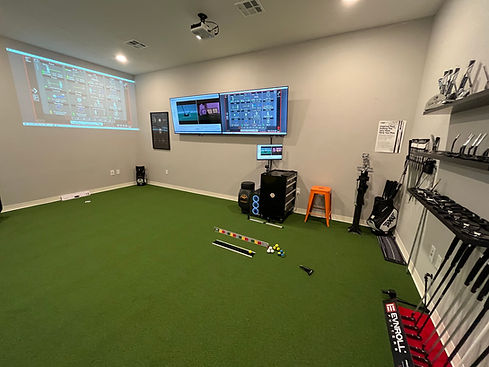
This screenshot has width=489, height=367. Find the location of `grey wall`. grey wall is located at coordinates [348, 115].